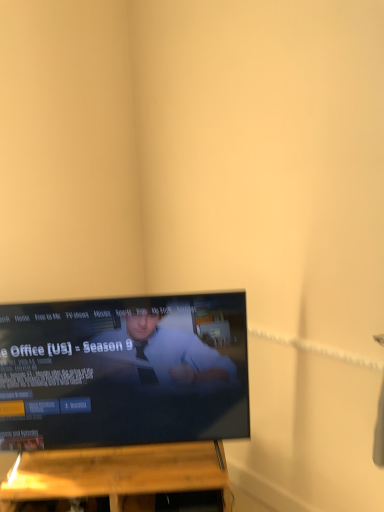
Question: Is black glossy tv at center positioned beyond the bounds of wooden shelf at lower center?

Choices:
 (A) yes
 (B) no

Answer: (A)

Question: From a real-world perspective, is black glossy tv at center physically below wooden shelf at lower center?

Choices:
 (A) no
 (B) yes

Answer: (A)

Question: Is black glossy tv at center bigger than wooden shelf at lower center?

Choices:
 (A) yes
 (B) no

Answer: (A)

Question: Is black glossy tv at center thinner than wooden shelf at lower center?

Choices:
 (A) yes
 (B) no

Answer: (A)

Question: Is black glossy tv at center beside wooden shelf at lower center?

Choices:
 (A) no
 (B) yes

Answer: (A)

Question: Could you tell me if black glossy tv at center is facing wooden shelf at lower center?

Choices:
 (A) no
 (B) yes

Answer: (A)

Question: Does wooden shelf at lower center appear on the right side of black glossy tv at center?

Choices:
 (A) yes
 (B) no

Answer: (A)

Question: Is wooden shelf at lower center in contact with black glossy tv at center?

Choices:
 (A) no
 (B) yes

Answer: (A)

Question: From a real-world perspective, is wooden shelf at lower center physically above black glossy tv at center?

Choices:
 (A) no
 (B) yes

Answer: (A)

Question: Is black glossy tv at center inside wooden shelf at lower center?

Choices:
 (A) no
 (B) yes

Answer: (A)

Question: Is wooden shelf at lower center taller than black glossy tv at center?

Choices:
 (A) yes
 (B) no

Answer: (B)

Question: Considering the relative sizes of wooden shelf at lower center and black glossy tv at center in the image provided, is wooden shelf at lower center smaller than black glossy tv at center?

Choices:
 (A) no
 (B) yes

Answer: (B)

Question: Considering their positions, is wooden shelf at lower center located in front of or behind black glossy tv at center?

Choices:
 (A) front
 (B) behind

Answer: (B)